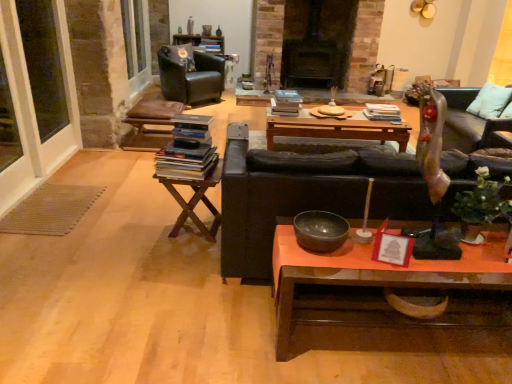
At what (x,y) coordinates should I click in order to perform the action: click on empty space that is in between black leather couch at center and woodenwoodentable at left. Please return your answer as a coordinate pair (x, y). The image size is (512, 384). Looking at the image, I should click on (195, 260).